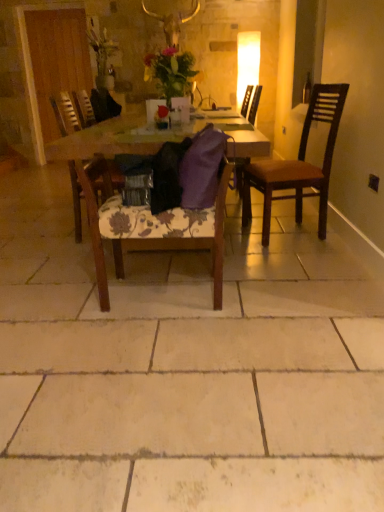
Locate an element on the screen. This screenshot has height=512, width=384. free space in front of wooden table at center is located at coordinates (188, 333).